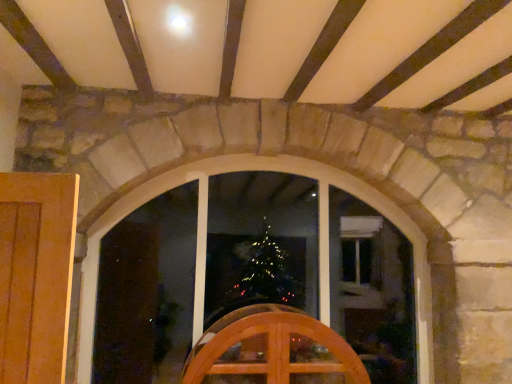
Describe the element at coordinates (272, 350) in the screenshot. This screenshot has width=512, height=384. I see `wooden chair at center` at that location.

The image size is (512, 384). In order to click on wooden chair at center in this screenshot , I will do `click(272, 350)`.

In the scene shown: What is the approximate height of clear glass window at center?

clear glass window at center is 5.43 feet tall.

This screenshot has width=512, height=384. Describe the element at coordinates (258, 170) in the screenshot. I see `clear glass window at center` at that location.

The height and width of the screenshot is (384, 512). Identify the location of clear glass window at center. (258, 170).

Identify the location of wooden chair at center. This screenshot has width=512, height=384. [272, 350].

Can you confirm if wooden chair at center is positioned to the right of clear glass window at center?

Yes.

Relative to clear glass window at center, is wooden chair at center in front or behind?

Visually, wooden chair at center is located in front of clear glass window at center.

Which is in front, point (286, 326) or point (428, 321)?

The point (286, 326) is closer to the camera.

From the image's perspective, which one is positioned lower, wooden chair at center or clear glass window at center?

wooden chair at center appears lower in the image.

From the picture: From a real-world perspective, who is located higher, wooden chair at center or clear glass window at center?

From a 3D spatial view, clear glass window at center is above.

Between wooden chair at center and clear glass window at center, which one has smaller width?

Thinner between the two is wooden chair at center.

Considering the relative sizes of wooden chair at center and clear glass window at center in the image provided, is wooden chair at center shorter than clear glass window at center?

Yes.

Between wooden chair at center and clear glass window at center, which one has larger size?

Bigger between the two is clear glass window at center.

Is wooden chair at center inside or outside of clear glass window at center?

wooden chair at center lies outside clear glass window at center.

Is wooden chair at center positioned far away from clear glass window at center?

Absolutely, wooden chair at center is distant from clear glass window at center.

Is wooden chair at center facing towards clear glass window at center?

No, wooden chair at center is not aimed at clear glass window at center.

How many degrees apart are the facing directions of wooden chair at center and clear glass window at center?

0.0236 degrees separate the facing orientations of wooden chair at center and clear glass window at center.

Find the location of a particular element. The width and height of the screenshot is (512, 384). window above the wooden chair at center (from the image's perspective) is located at coordinates (258, 170).

Is clear glass window at center to the right of wooden chair at center from the viewer's perspective?

No, clear glass window at center is not to the right of wooden chair at center.

Is clear glass window at center in front of or behind wooden chair at center in the image?

clear glass window at center is behind wooden chair at center.

Is point (225, 157) positioned before point (204, 380)?

No, (225, 157) is behind (204, 380).

From the image's perspective, between clear glass window at center and wooden chair at center, which one is located above?

clear glass window at center appears higher in the image.

From a real-world perspective, who is located higher, clear glass window at center or wooden chair at center?

clear glass window at center is physically above.

Which of these two, clear glass window at center or wooden chair at center, is wider?

clear glass window at center.

Who is taller, clear glass window at center or wooden chair at center?

With more height is clear glass window at center.

Which of these two, clear glass window at center or wooden chair at center, is smaller?

With smaller size is wooden chair at center.

Can we say clear glass window at center lies outside wooden chair at center?

Yes, clear glass window at center is outside of wooden chair at center.

Are clear glass window at center and wooden chair at center far apart?

Indeed, clear glass window at center is not near wooden chair at center.

Could you tell me if clear glass window at center is facing wooden chair at center?

Yes, clear glass window at center faces towards wooden chair at center.

From the picture: What's the angular difference between clear glass window at center and wooden chair at center's facing directions?

0.0236 degrees.

Locate an element on the screen. This screenshot has width=512, height=384. window lying behind the wooden chair at center is located at coordinates (258, 170).

What are the coordinates of `window that appears behind the wooden chair at center` in the screenshot? It's located at (258, 170).

You are a GUI agent. You are given a task and a screenshot of the screen. Output one action in this format:
    pyautogui.click(x=<x>, y=<y>)
    Task: Click on the furniture located underneath the clear glass window at center (from a real-world perspective)
    The height and width of the screenshot is (384, 512).
    Given the screenshot: What is the action you would take?
    pyautogui.click(x=272, y=350)